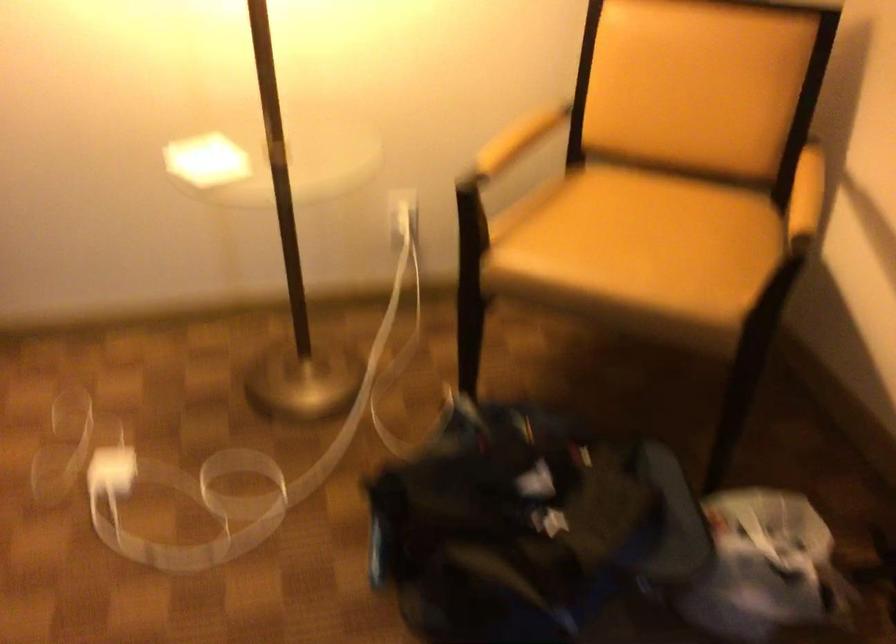
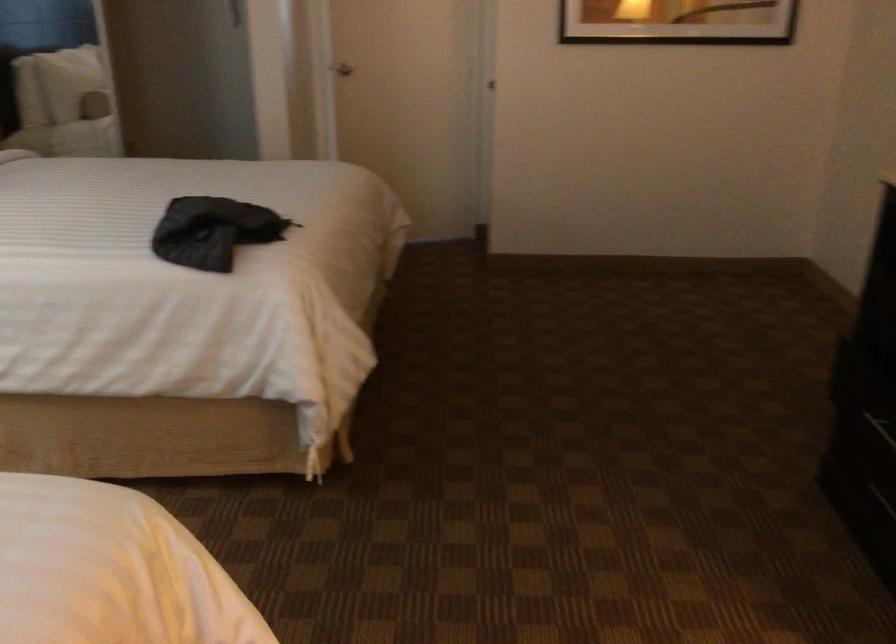
The first image is from the beginning of the video and the second image is from the end. How did the camera likely rotate when shooting the video?

The camera rotated toward left-down.